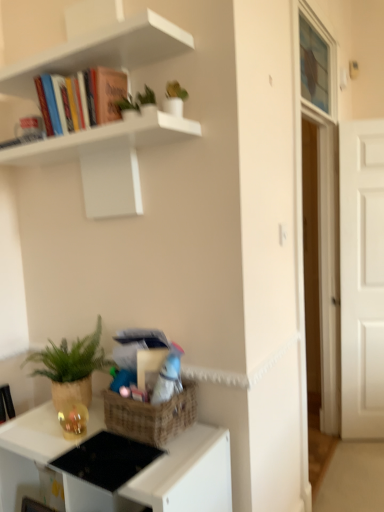
Question: Looking at their shapes, would you say white matte shelf at upper left is wider or thinner than matte black desk at lower left?

Choices:
 (A) wide
 (B) thin

Answer: (B)

Question: From the image's perspective, is white matte shelf at upper left positioned above or below matte black desk at lower left?

Choices:
 (A) below
 (B) above

Answer: (B)

Question: Considering the real-world distances, which object is closest to the matte black desk at lower left?

Choices:
 (A) white matte door at right
 (B) translucent glass window screen at upper right
 (C) white matte shelf at upper left
 (D) green woven basket at lower left

Answer: (D)

Question: Based on their relative distances, which object is nearer to the matte black desk at lower left?

Choices:
 (A) green woven basket at lower left
 (B) white matte door at right
 (C) translucent glass window screen at upper right
 (D) white matte shelf at upper left

Answer: (A)